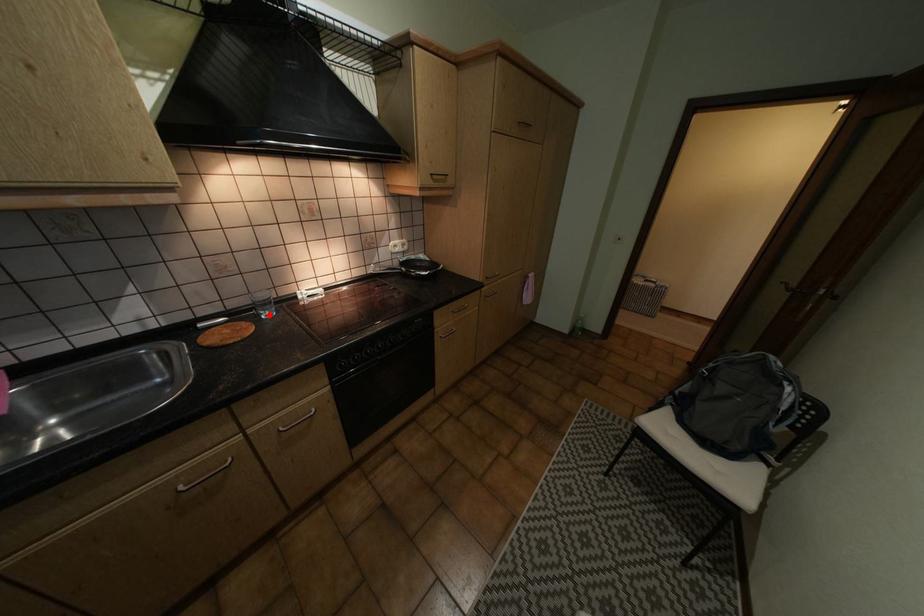
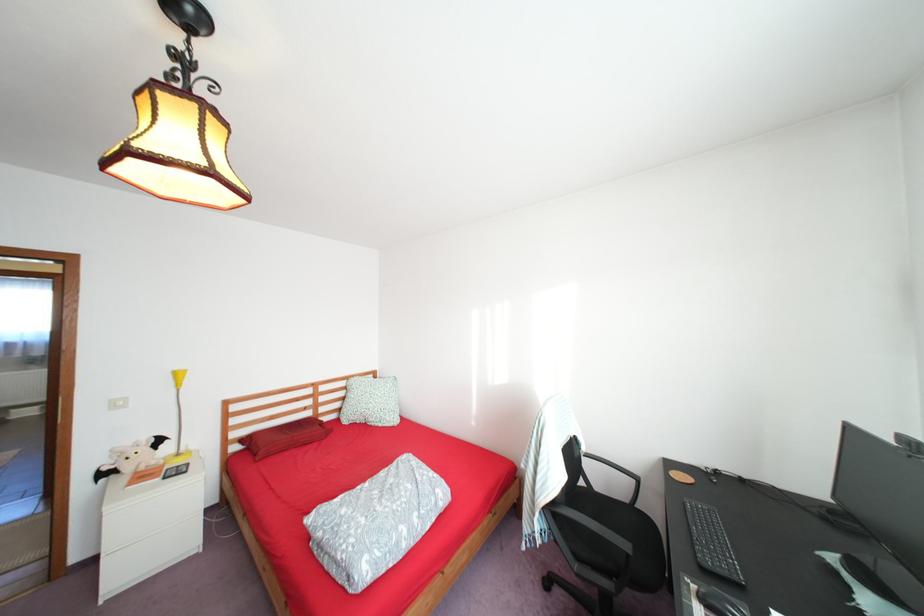
Question: I am providing you with two images of the same scene from different viewpoints. A red point is marked on the first image. At the location where the point appears in image 1, is it still visible in image 2?

Choices:
 (A) Yes
 (B) No

Answer: (B)